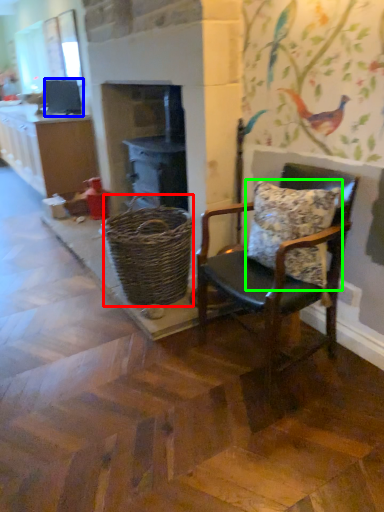
Question: Which object is positioned farthest from basket (highlighted by a red box)? Select from appliance (highlighted by a blue box) and pillow (highlighted by a green box).

Choices:
 (A) appliance
 (B) pillow

Answer: (A)